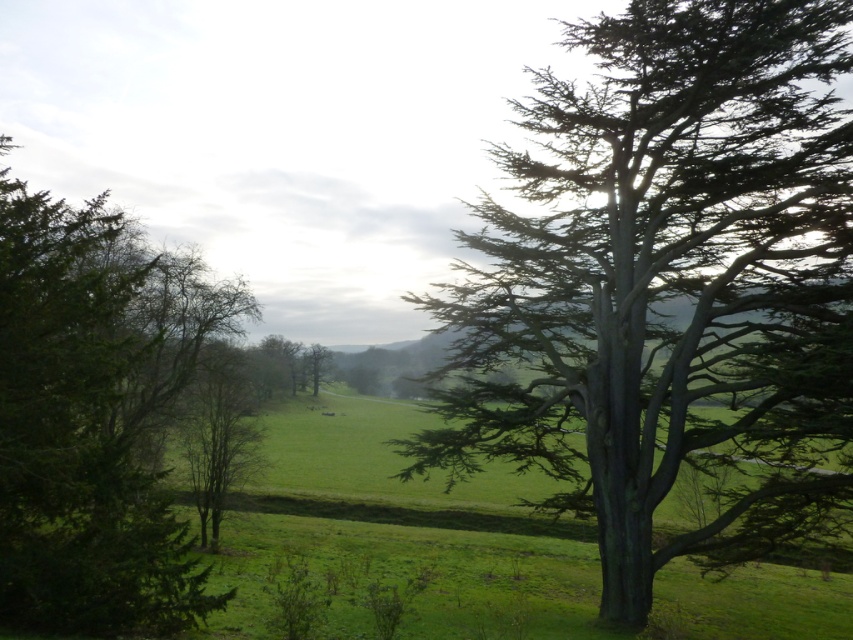
Question: Does bare branches at center have a greater width compared to green matte tree at center?

Choices:
 (A) yes
 (B) no

Answer: (A)

Question: Among these points, which one is farthest from the camera?

Choices:
 (A) (218, 513)
 (B) (306, 369)
 (C) (105, 339)

Answer: (B)

Question: Which of the following is the closest to the observer?

Choices:
 (A) tap(701, 221)
 (B) tap(223, 348)
 (C) tap(181, 323)
 (D) tap(314, 344)

Answer: (A)

Question: Is the position of green matte tree at left more distant than that of green matte tree at center?

Choices:
 (A) yes
 (B) no

Answer: (B)

Question: In this image, where is bare branches at center located relative to green matte tree at center?

Choices:
 (A) right
 (B) left

Answer: (A)

Question: Which point appears farthest from the camera in this image?

Choices:
 (A) (169, 529)
 (B) (213, 412)
 (C) (444, 438)
 (D) (314, 353)

Answer: (D)